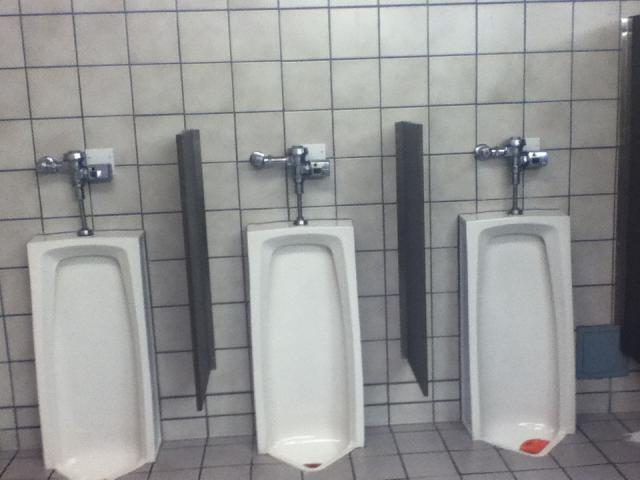
Find the location of a particular element. The image size is (640, 480). side of the urnial is located at coordinates (44, 410).